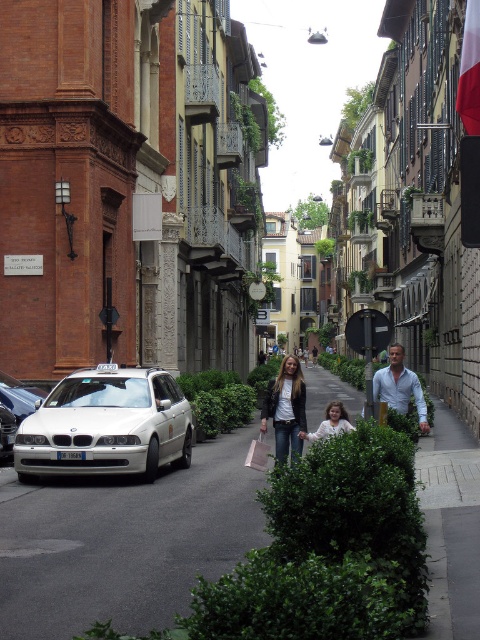
Question: Does gray asphalt pavement at center have a lesser width compared to denim jacket at center?

Choices:
 (A) no
 (B) yes

Answer: (A)

Question: Which point is closer to the camera?

Choices:
 (A) denim jacket at center
 (B) silver metallic car at center
 (C) white matte car at center
 (D) white fabric flag at upper right

Answer: (A)

Question: Observing the image, what is the correct spatial positioning of gray asphalt pavement at center in reference to white fabric flag at upper right?

Choices:
 (A) left
 (B) right

Answer: (A)

Question: Considering the relative positions of white matte car at center and denim jacket at center in the image provided, where is white matte car at center located with respect to denim jacket at center?

Choices:
 (A) right
 (B) left

Answer: (B)

Question: Estimate the real-world distances between objects in this image. Which object is farther from the white fabric flag at upper right?

Choices:
 (A) white matte shirt at center
 (B) gray asphalt pavement at center
 (C) silver metallic car at center
 (D) white matte car at center

Answer: (C)

Question: Which point is farther to the camera?

Choices:
 (A) white matte car at center
 (B) white fabric flag at upper right
 (C) white matte shirt at center

Answer: (A)